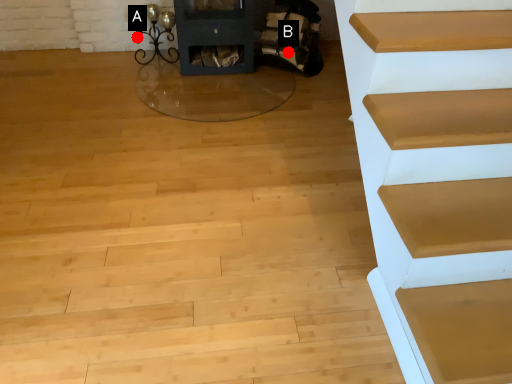
Question: Two points are circled on the image, labeled by A and B beside each circle. Which point is closer to the camera taking this photo?

Choices:
 (A) A is closer
 (B) B is closer

Answer: (B)